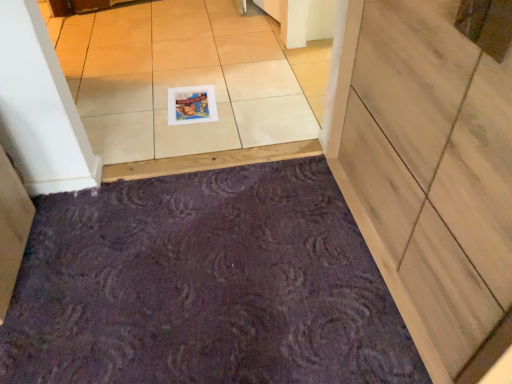
What are the coordinates of `free space above matte plastic postcard at center (from a real-world perspective)` in the screenshot? It's located at (188, 96).